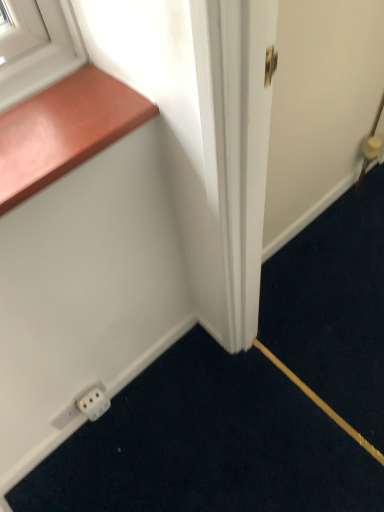
Identify the location of empty space that is ontop of wooden at upper left. The image size is (384, 512). (59, 114).